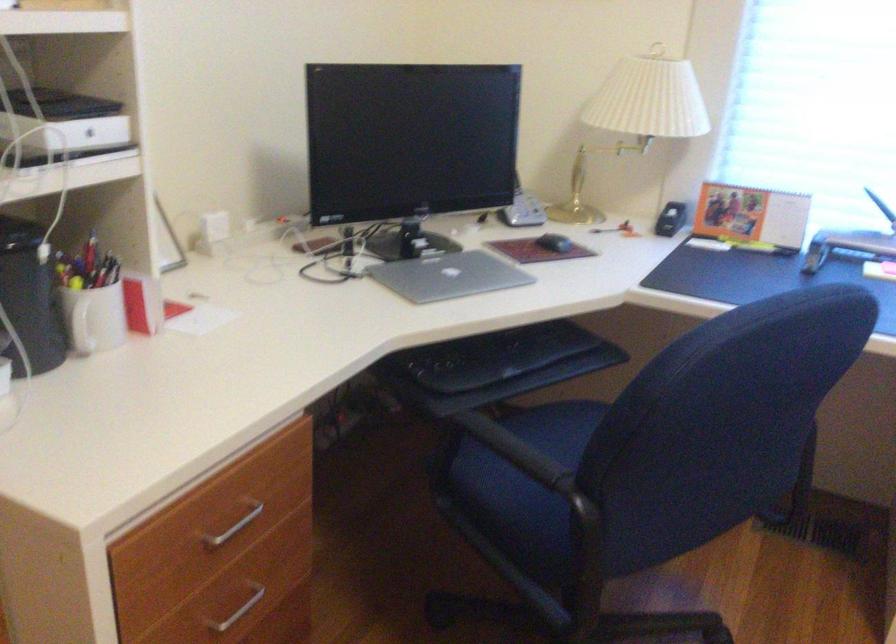
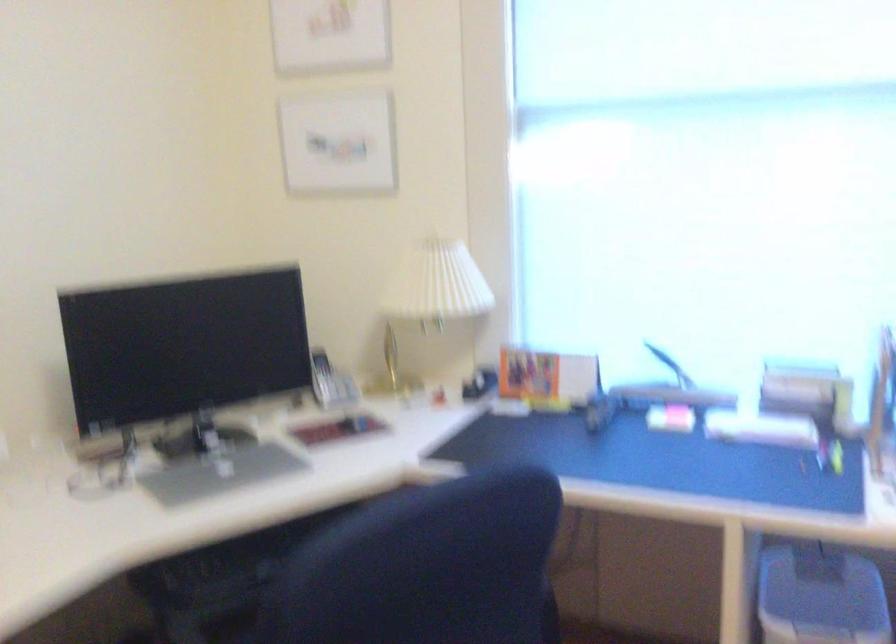
Question: What movement of the cameraman would produce the second image?

Choices:
 (A) Left
 (B) Right
 (C) Forward
 (D) Backward

Answer: (B)